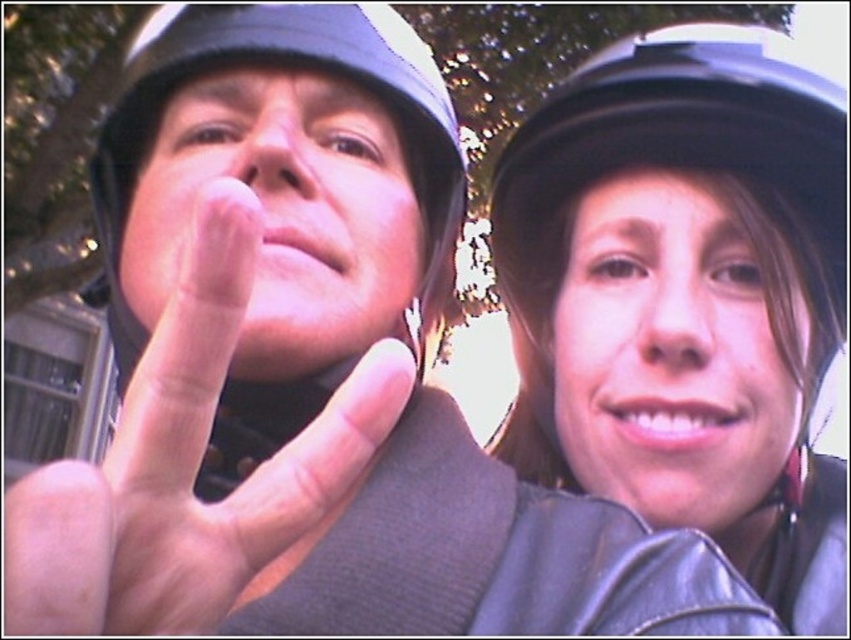
You are a photographer trying to capture a photo of the two points in the image. The first point is labeled as point (243,557) and the second is point (795,435). Based on their positions, which point is closer to the camera?

Point (243,557) is closer to the camera because it is in front of point (795,435).

You are a photographer standing 5 feet away from the black leather helmet at upper center. Can you capture the entire helmet in your camera frame without moving closer?

The black leather helmet at upper center is 26.30 inches away from the camera. Since you are standing 5 feet away, which is 60 inches, the distance is sufficient to capture the entire helmet in the frame without moving closer.

You are designing a poster for a motorcycle club event. The poster must include both the black leather helmet at upper center and the matte black helmet at right. To ensure they are clearly visible, what is the minimum space you should leave between them?

The minimum space between the black leather helmet at upper center and the matte black helmet at right should be at least 2.81 centimeters to ensure they are clearly visible.